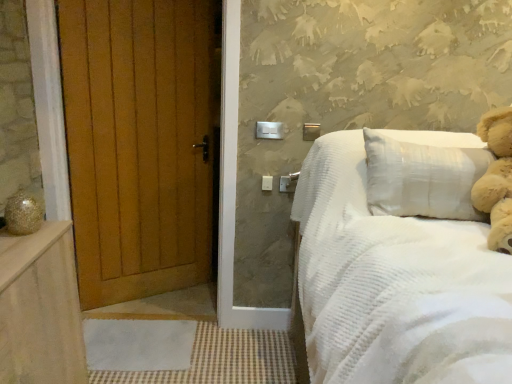
Question: Is fluffy beige teddy bear at upper right facing towards wooden door at left?

Choices:
 (A) yes
 (B) no

Answer: (B)

Question: Considering the relative sizes of fluffy beige teddy bear at upper right and wooden door at left in the image provided, is fluffy beige teddy bear at upper right thinner than wooden door at left?

Choices:
 (A) yes
 (B) no

Answer: (B)

Question: Is fluffy beige teddy bear at upper right far away from wooden door at left?

Choices:
 (A) yes
 (B) no

Answer: (A)

Question: Does fluffy beige teddy bear at upper right have a larger size compared to wooden door at left?

Choices:
 (A) yes
 (B) no

Answer: (B)

Question: Considering the relative positions of fluffy beige teddy bear at upper right and wooden door at left in the image provided, is fluffy beige teddy bear at upper right to the left of wooden door at left from the viewer's perspective?

Choices:
 (A) no
 (B) yes

Answer: (A)

Question: Is wooden door at left to the left or to the right of white corduroy bed at right in the image?

Choices:
 (A) right
 (B) left

Answer: (B)

Question: Do you think wooden door at left is within white corduroy bed at right, or outside of it?

Choices:
 (A) outside
 (B) inside

Answer: (A)

Question: Based on their sizes in the image, would you say wooden door at left is bigger or smaller than white corduroy bed at right?

Choices:
 (A) small
 (B) big

Answer: (A)

Question: In terms of width, does wooden door at left look wider or thinner when compared to white corduroy bed at right?

Choices:
 (A) thin
 (B) wide

Answer: (A)

Question: Considering their positions, is white corduroy bed at right located in front of or behind fluffy beige teddy bear at upper right?

Choices:
 (A) behind
 (B) front

Answer: (B)

Question: Visually, is white corduroy bed at right positioned to the left or to the right of fluffy beige teddy bear at upper right?

Choices:
 (A) right
 (B) left

Answer: (B)

Question: Is white corduroy bed at right bigger or smaller than fluffy beige teddy bear at upper right?

Choices:
 (A) small
 (B) big

Answer: (B)

Question: From the image's perspective, is white corduroy bed at right located above or below fluffy beige teddy bear at upper right?

Choices:
 (A) above
 (B) below

Answer: (B)

Question: From their relative heights in the image, would you say fluffy beige teddy bear at upper right is taller or shorter than white corduroy bed at right?

Choices:
 (A) short
 (B) tall

Answer: (A)

Question: In terms of size, does fluffy beige teddy bear at upper right appear bigger or smaller than white corduroy bed at right?

Choices:
 (A) big
 (B) small

Answer: (B)